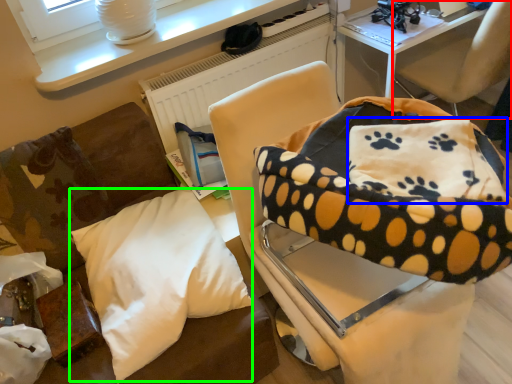
Question: Based on their relative distances, which object is farther from chair (highlighted by a red box)? Choose from pillow (highlighted by a blue box) and pillow (highlighted by a green box).

Choices:
 (A) pillow
 (B) pillow

Answer: (B)